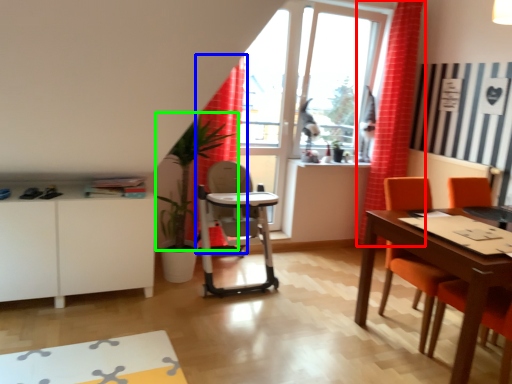
Question: Considering the real-world distances, which object is closest to curtain (highlighted by a red box)? curtain (highlighted by a blue box) or plant (highlighted by a green box).

Choices:
 (A) curtain
 (B) plant

Answer: (A)